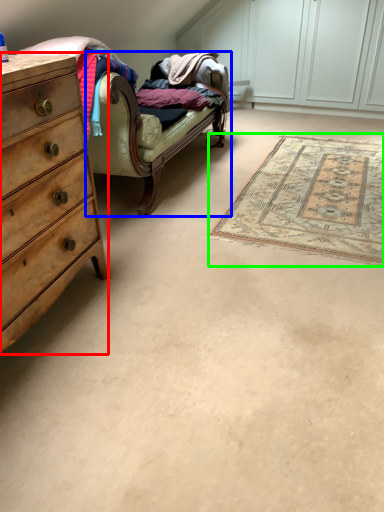
Question: Considering the real-world distances, which object is farthest from chest of drawers (highlighted by a red box)? studio couch (highlighted by a blue box) or mat (highlighted by a green box)?

Choices:
 (A) studio couch
 (B) mat

Answer: (B)